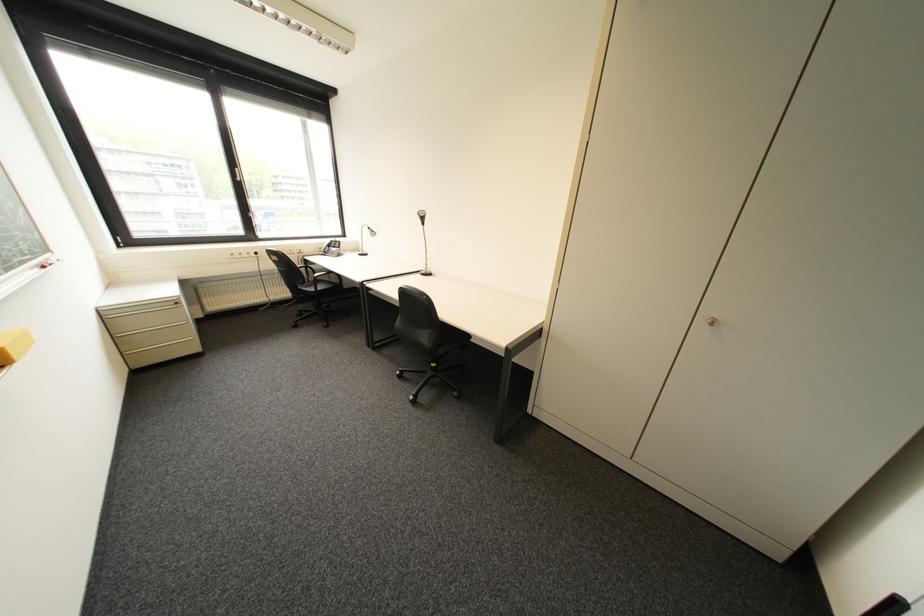
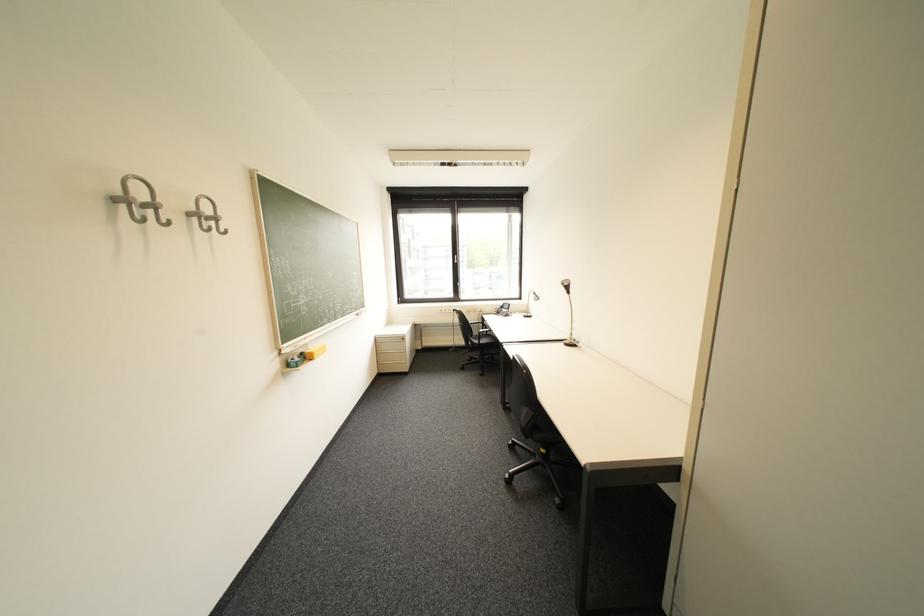
In the second image, find the point that corresponds to (326,275) in the first image.

(492, 331)